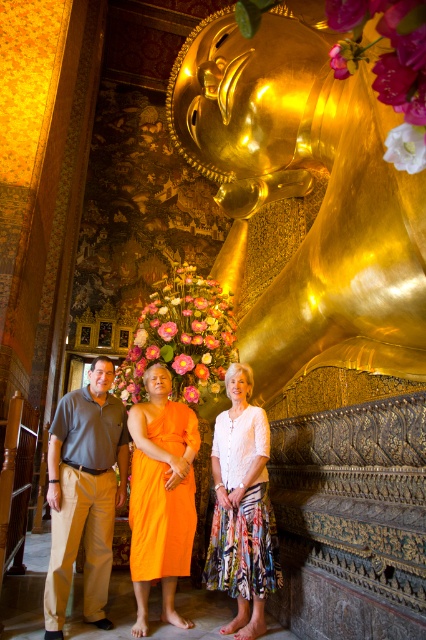
Question: Among these objects, which one is farthest from the camera?

Choices:
 (A) matte orange robe at center
 (B) white floral skirt at center
 (C) orange silk robe at center
 (D) gold polished statue at center

Answer: (B)

Question: Can you confirm if matte orange robe at center is positioned below white floral skirt at center?

Choices:
 (A) yes
 (B) no

Answer: (A)

Question: Which point is farther from the camera taking this photo?

Choices:
 (A) (264, 428)
 (B) (230, 212)

Answer: (B)

Question: Does white floral skirt at center have a smaller size compared to orange silk robe at center?

Choices:
 (A) no
 (B) yes

Answer: (B)

Question: Can you confirm if khaki cotton pants at center is positioned to the right of orange silk robe at center?

Choices:
 (A) no
 (B) yes

Answer: (A)

Question: Which of the following is the farthest from the observer?

Choices:
 (A) white floral skirt at center
 (B) khaki cotton pants at center
 (C) gold polished statue at center
 (D) orange silk robe at center

Answer: (B)